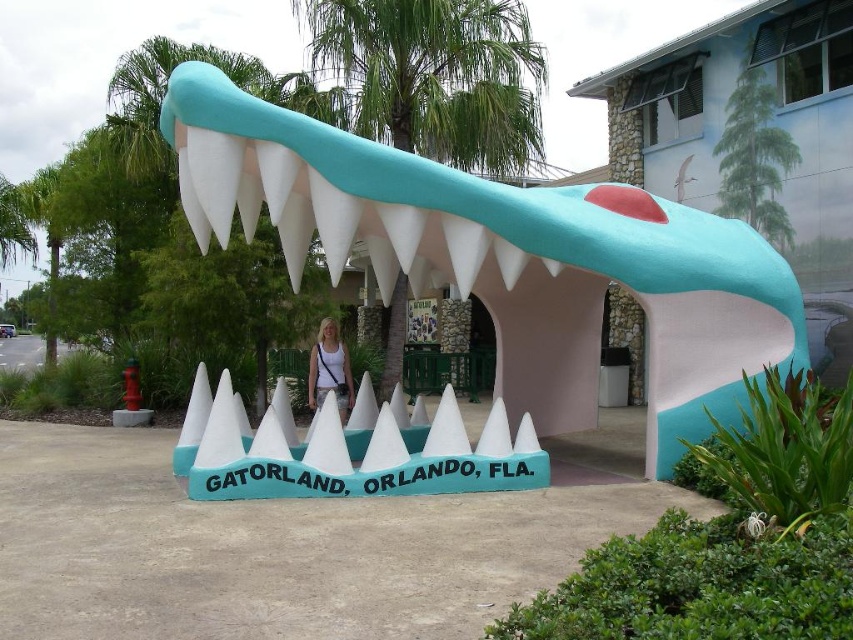
Question: Does green leafy palm tree at center have a greater width compared to white fabric shirt at center?

Choices:
 (A) no
 (B) yes

Answer: (B)

Question: Is matte blue sculpture at center to the right of white fabric shirt at center from the viewer's perspective?

Choices:
 (A) no
 (B) yes

Answer: (B)

Question: Estimate the real-world distances between objects in this image. Which object is farther from the matte blue sculpture at center?

Choices:
 (A) white fabric shirt at center
 (B) green leafy palm tree at center

Answer: (B)

Question: Estimate the real-world distances between objects in this image. Which object is farther from the matte blue sculpture at center?

Choices:
 (A) white fabric shirt at center
 (B) green leafy palm tree at center

Answer: (B)

Question: Among these points, which one is farthest from the camera?

Choices:
 (A) (318, 369)
 (B) (163, 124)

Answer: (A)

Question: Does matte blue sculpture at center have a smaller size compared to white fabric shirt at center?

Choices:
 (A) yes
 (B) no

Answer: (B)